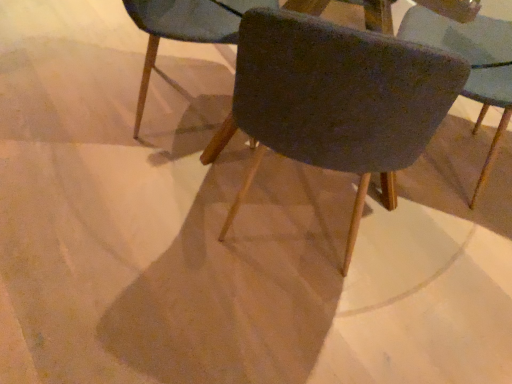
This screenshot has height=384, width=512. What are the coordinates of `vacant space to the right of velvet dark blue chair at center, the second chair when ordered from right to left` in the screenshot? It's located at (428, 269).